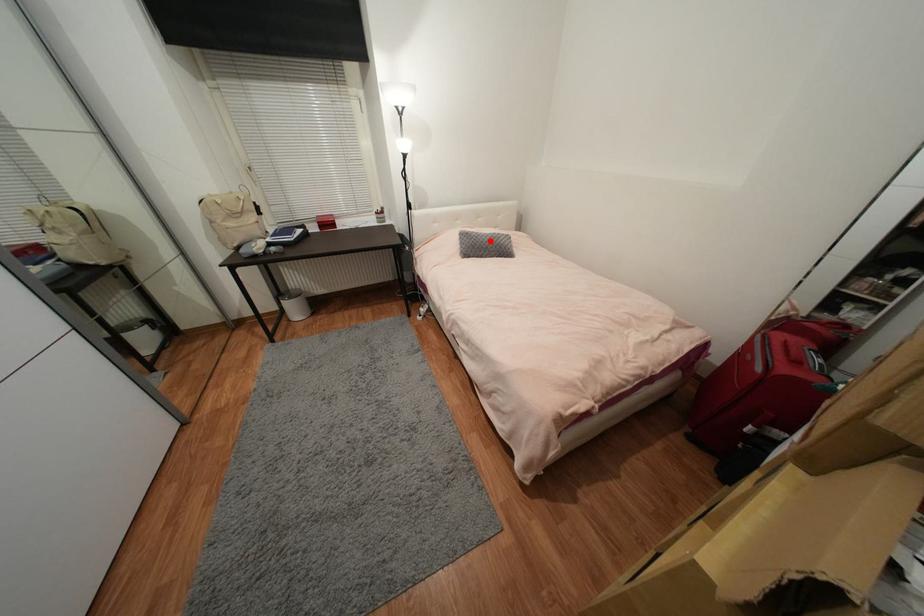
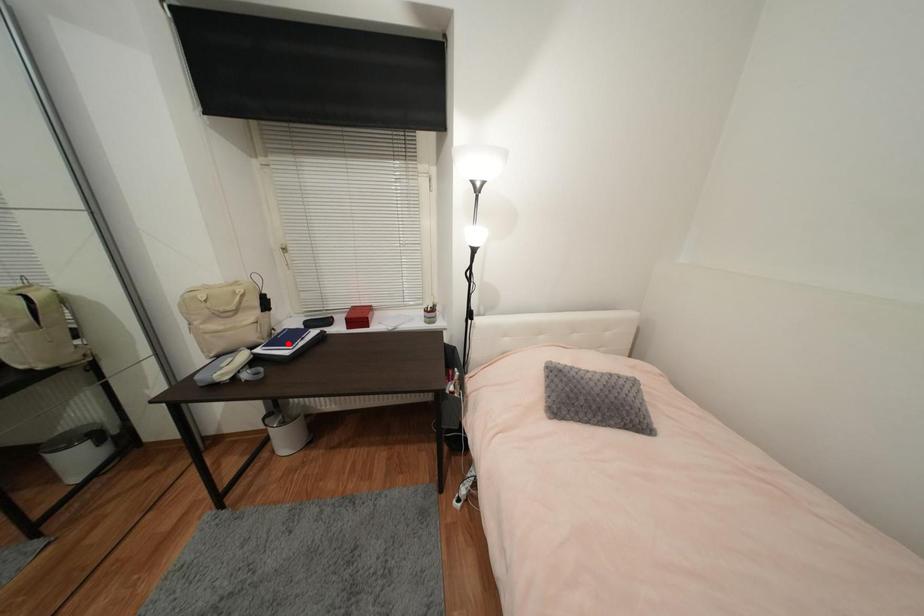
I am providing you with two images of the same scene from different viewpoints. A red point is marked on the first image and another point is marked on the second image. Are the points marked in image1 and image2 representing the same 3D position?

No